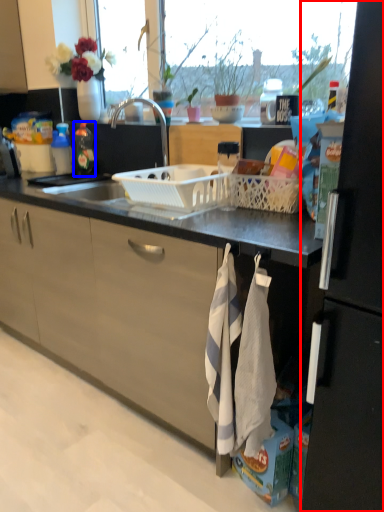
Question: Which point is further to the camera, refrigerator (highlighted by a red box) or kitchen appliance (highlighted by a blue box)?

Choices:
 (A) refrigerator
 (B) kitchen appliance

Answer: (B)